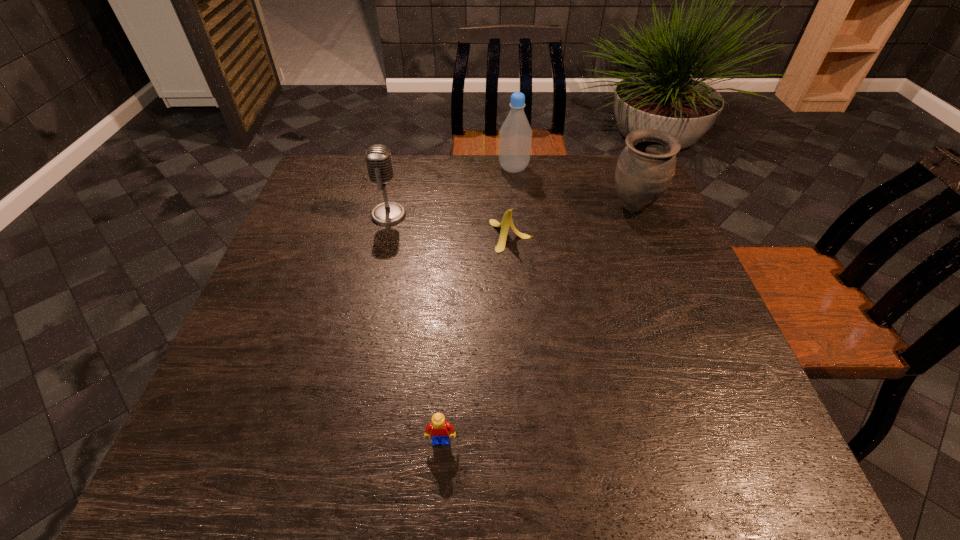
Find the location of a particular element. the farthest object is located at coordinates (515, 136).

Where is `microphone`? microphone is located at coordinates (378, 157).

The height and width of the screenshot is (540, 960). What are the coordinates of `urn` in the screenshot? It's located at (646, 166).

The image size is (960, 540). In order to click on the second shortest object in this screenshot , I will do pos(507,221).

The height and width of the screenshot is (540, 960). In order to click on Lego in this screenshot , I will do 439,428.

You are a GUI agent. You are given a task and a screenshot of the screen. Output one action in this format:
    pyautogui.click(x=<x>, y=<y>)
    Task: Click on the second object from left to right
    This screenshot has width=960, height=540.
    Given the screenshot: What is the action you would take?
    pyautogui.click(x=439, y=428)

The image size is (960, 540). In order to click on vacant region located on the front of the bottle in this screenshot , I will do `click(516, 191)`.

Identify the location of vacant point located 0.050m on the right of the leftmost object. The width and height of the screenshot is (960, 540). (424, 215).

Where is `free space located 0.200m on the back of the rightmost object`? Image resolution: width=960 pixels, height=540 pixels. free space located 0.200m on the back of the rightmost object is located at coordinates (613, 156).

Image resolution: width=960 pixels, height=540 pixels. Find the location of `free region located 0.100m on the front of the banana`. free region located 0.100m on the front of the banana is located at coordinates (515, 282).